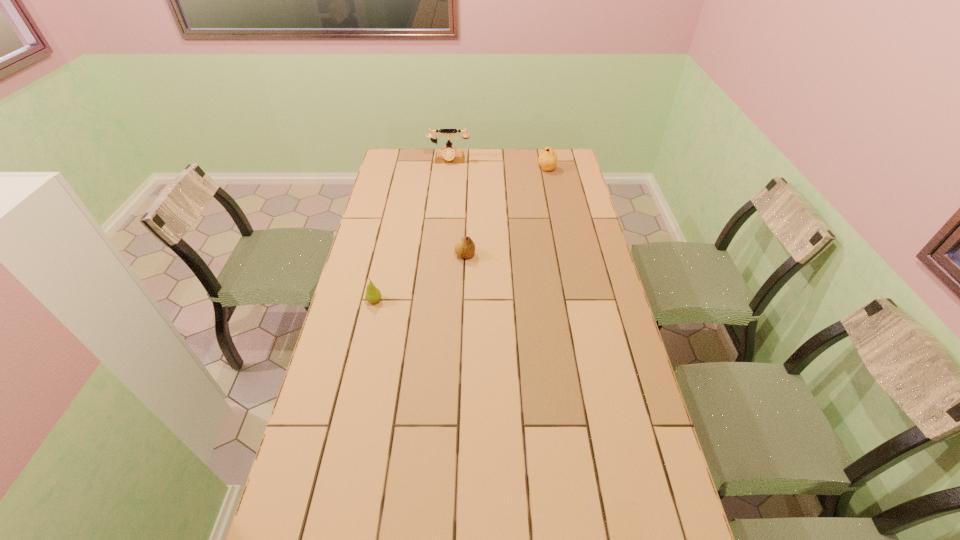
Find the location of `free space located 0.290m on the front of the third farthest object`. free space located 0.290m on the front of the third farthest object is located at coordinates (463, 322).

Locate an element on the screen. The image size is (960, 540). telephone that is at the far edge is located at coordinates (448, 155).

The height and width of the screenshot is (540, 960). What are the coordinates of `pear present at the far edge` in the screenshot? It's located at (547, 159).

The height and width of the screenshot is (540, 960). In order to click on object that is at the left edge in this screenshot , I will do `click(373, 294)`.

Identify the location of object that is at the right edge. This screenshot has width=960, height=540. (547, 159).

Locate an element on the screen. The image size is (960, 540). object present at the far right corner is located at coordinates (547, 159).

This screenshot has height=540, width=960. Find the location of `free space at the far edge`. free space at the far edge is located at coordinates (420, 174).

The height and width of the screenshot is (540, 960). Find the location of `vacant region at the left edge`. vacant region at the left edge is located at coordinates (387, 192).

This screenshot has width=960, height=540. I want to click on vacant space at the right edge, so click(555, 209).

Locate an element on the screen. The image size is (960, 540). free space at the far right corner of the desktop is located at coordinates (565, 167).